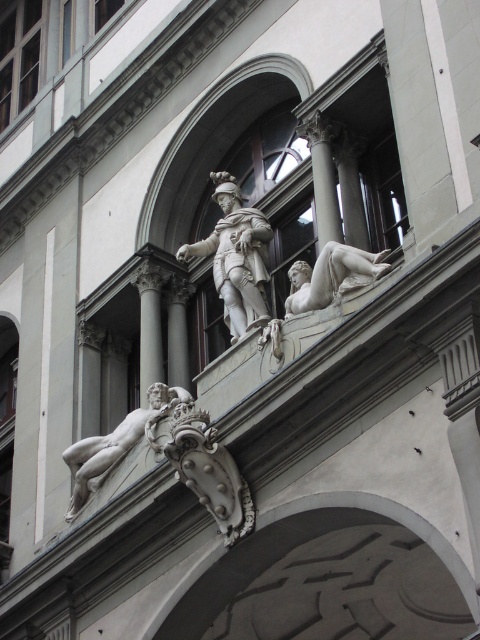
Between white marble statue at center and white marble nude at lower left, which one has less height?

white marble nude at lower left is shorter.

Locate an element on the screen. This screenshot has height=640, width=480. white marble statue at center is located at coordinates (236, 257).

This screenshot has height=640, width=480. Identify the location of white marble statue at center. (236, 257).

Who is shorter, white marble nude at lower left or white marble reclining figure at right?

white marble reclining figure at right

Can you confirm if white marble nude at lower left is bigger than white marble reclining figure at right?

Indeed, white marble nude at lower left has a larger size compared to white marble reclining figure at right.

This screenshot has height=640, width=480. I want to click on white marble nude at lower left, so click(118, 444).

Is white marble statue at center smaller than white marble reclining figure at right?

No.

Is white marble statue at center closer to camera compared to white marble reclining figure at right?

No, white marble statue at center is behind white marble reclining figure at right.

This screenshot has width=480, height=640. Find the location of `white marble statue at center`. white marble statue at center is located at coordinates (236, 257).